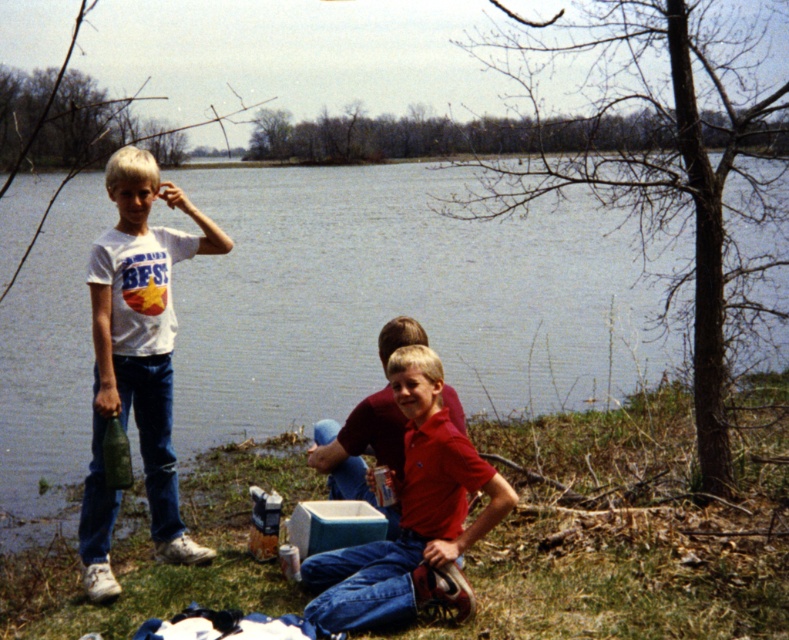
Question: Is blue water at center further to camera compared to white matte t-shirt at left?

Choices:
 (A) no
 (B) yes

Answer: (B)

Question: Is the position of blue water at center more distant than that of matte red shirt at center?

Choices:
 (A) yes
 (B) no

Answer: (A)

Question: Which point appears closest to the camera in this image?

Choices:
 (A) (36, 467)
 (B) (166, 308)

Answer: (B)

Question: Which point appears closest to the camera in this image?

Choices:
 (A) (339, 582)
 (B) (92, 532)

Answer: (A)

Question: Is white matte t-shirt at left further to the viewer compared to matte red shirt at center?

Choices:
 (A) yes
 (B) no

Answer: (A)

Question: Which is nearer to the blue water at center?

Choices:
 (A) matte red shirt at center
 (B) white matte t-shirt at left

Answer: (A)